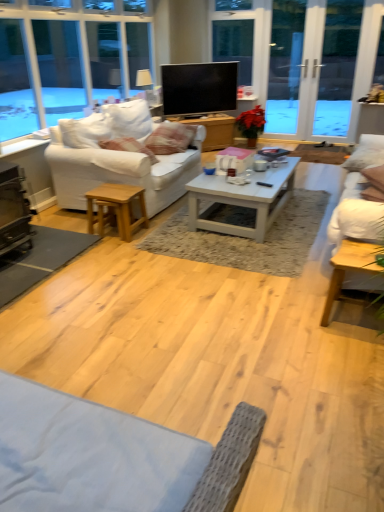
What are the coordinates of `vacant area situated below light brown wooden coffee table at center, acting as the 1th coffee table starting from the bottom (from a real-world perspective)` in the screenshot? It's located at tap(357, 321).